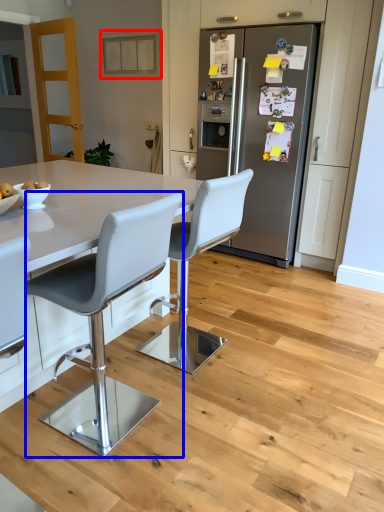
Question: Which of the following is the closest to the observer, cabinetry (highlighted by a red box) or chair (highlighted by a blue box)?

Choices:
 (A) cabinetry
 (B) chair

Answer: (B)